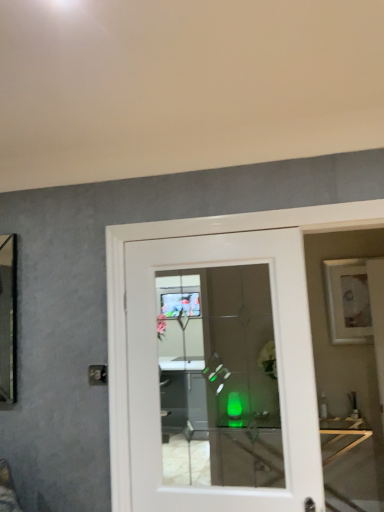
Question: Is white glossy door at center closer to the viewer compared to white matte picture frame at upper right?

Choices:
 (A) yes
 (B) no

Answer: (A)

Question: Is white glossy door at center next to white matte picture frame at upper right and touching it?

Choices:
 (A) no
 (B) yes

Answer: (A)

Question: Is white glossy door at center shorter than white matte picture frame at upper right?

Choices:
 (A) no
 (B) yes

Answer: (A)

Question: From a real-world perspective, is white glossy door at center positioned under white matte picture frame at upper right based on gravity?

Choices:
 (A) no
 (B) yes

Answer: (B)

Question: From a real-world perspective, does white glossy door at center stand above white matte picture frame at upper right?

Choices:
 (A) no
 (B) yes

Answer: (A)

Question: Is point (352, 271) closer or farther from the camera than point (152, 304)?

Choices:
 (A) closer
 (B) farther

Answer: (B)

Question: From a real-world perspective, is white matte picture frame at upper right physically located above or below white glossy door at center?

Choices:
 (A) below
 (B) above

Answer: (B)

Question: Is white matte picture frame at upper right wider or thinner than white glossy door at center?

Choices:
 (A) thin
 (B) wide

Answer: (A)

Question: Choose the correct answer: Is white matte picture frame at upper right inside white glossy door at center or outside it?

Choices:
 (A) inside
 (B) outside

Answer: (B)

Question: Considering the positions of point (304, 281) and point (339, 290), is point (304, 281) closer or farther from the camera than point (339, 290)?

Choices:
 (A) closer
 (B) farther

Answer: (A)

Question: Is white glossy door at center situated inside white matte picture frame at upper right or outside?

Choices:
 (A) outside
 (B) inside

Answer: (A)

Question: From a real-world perspective, is white glossy door at center positioned above or below white matte picture frame at upper right?

Choices:
 (A) above
 (B) below

Answer: (B)

Question: From the image's perspective, is white glossy door at center located above or below white matte picture frame at upper right?

Choices:
 (A) below
 (B) above

Answer: (A)

Question: From a real-world perspective, is translucent glass table at center above or below white glossy door at center?

Choices:
 (A) below
 (B) above

Answer: (A)

Question: From the image's perspective, is translucent glass table at center above or below white glossy door at center?

Choices:
 (A) above
 (B) below

Answer: (B)